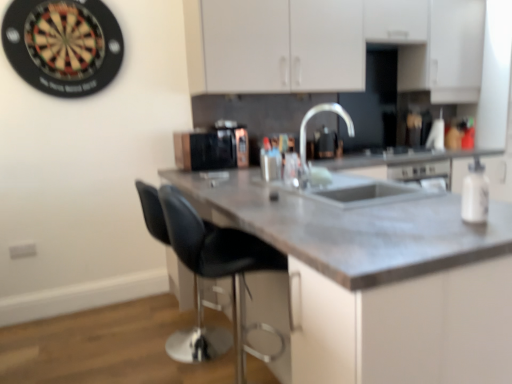
You are a GUI agent. You are given a task and a screenshot of the screen. Output one action in this format:
    pyautogui.click(x=<x>, y=<y>)
    Task: Click on the space that is in front of white matte bottle at right
    This screenshot has width=512, height=384.
    Given the screenshot: What is the action you would take?
    pyautogui.click(x=488, y=219)